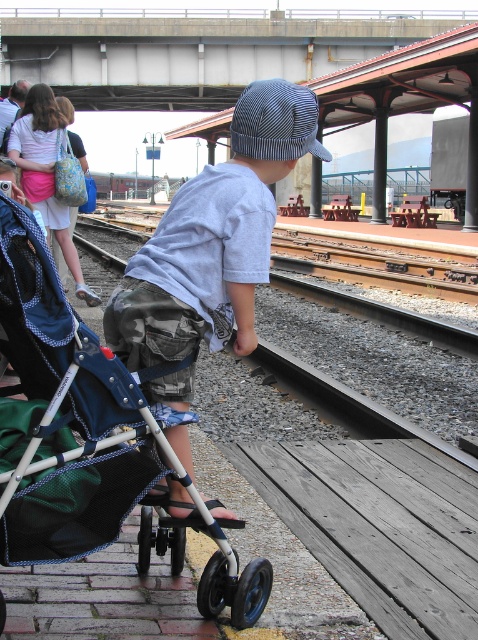
Is light blue cotton shirt at center positioned in front of brown gravel train track at center?

Yes, it is in front of brown gravel train track at center.

Does point (236, 320) lie in front of point (444, 442)?

Yes, it is.

Where is `light blue cotton shirt at center`? The height and width of the screenshot is (640, 478). light blue cotton shirt at center is located at coordinates (214, 237).

Where is `blue fabric stroller at lower left`? The height and width of the screenshot is (640, 478). blue fabric stroller at lower left is located at coordinates (65, 416).

Which of these two, blue fabric stroller at lower left or light blue cotton shirt at center, stands taller?

light blue cotton shirt at center

Does point (141, 420) come in front of point (291, 163)?

Yes.

The width and height of the screenshot is (478, 640). I want to click on blue fabric stroller at lower left, so click(65, 416).

Between blue fabric stroller at lower left and brown gravel train track at center, which one appears on the right side from the viewer's perspective?

blue fabric stroller at lower left

Can you confirm if blue fabric stroller at lower left is bigger than brown gravel train track at center?

No.

The width and height of the screenshot is (478, 640). I want to click on blue fabric stroller at lower left, so click(x=65, y=416).